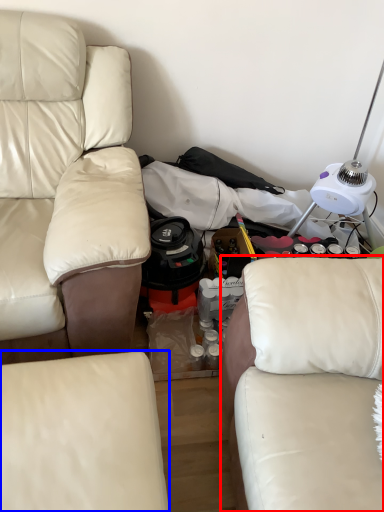
Question: Among these objects, which one is farthest to the camera, studio couch (highlighted by a red box) or studio couch (highlighted by a blue box)?

Choices:
 (A) studio couch
 (B) studio couch

Answer: (B)